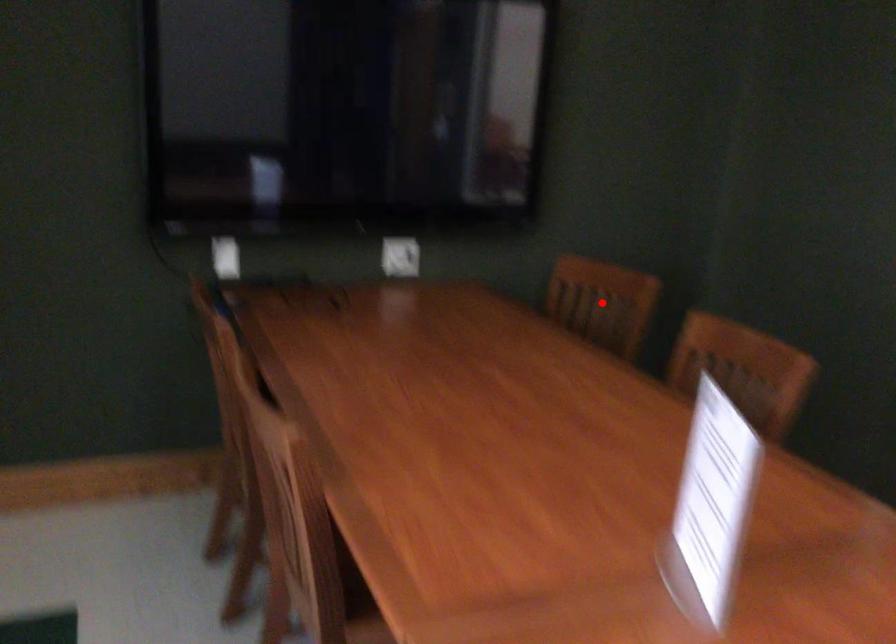
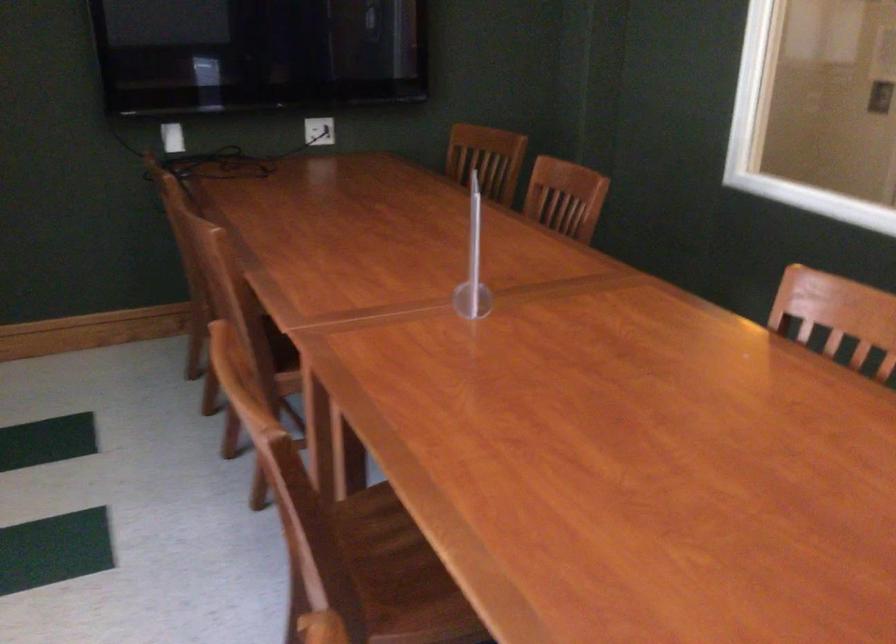
Question: I am providing you with two images of the same scene from different viewpoints. A red point is shown in image1. For the corresponding object point in image2, is it positioned nearer or farther from the camera?

Choices:
 (A) Nearer
 (B) Farther

Answer: (B)